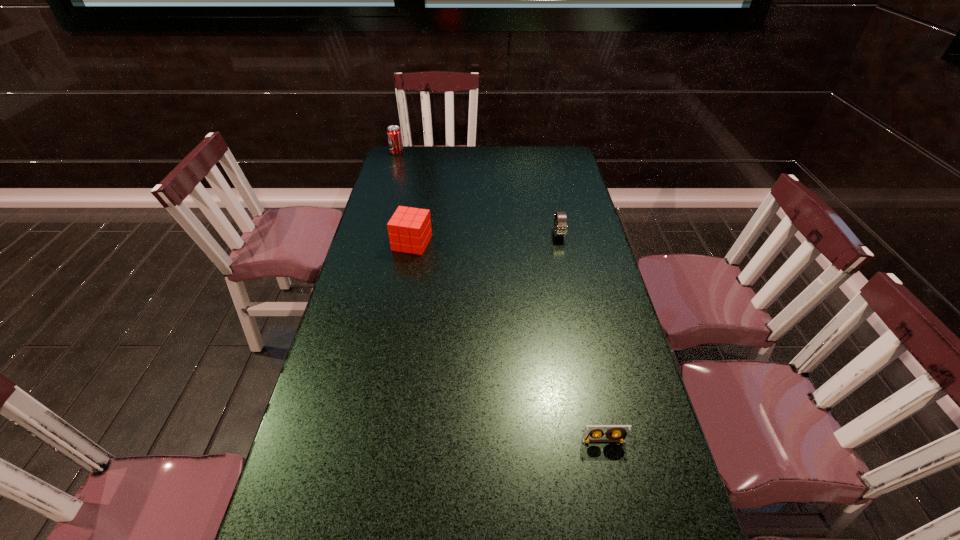
At what (x,y) coordinates should I click in order to perform the action: click on object at the far edge. Please return your answer as a coordinate pair (x, y). The width and height of the screenshot is (960, 540). Looking at the image, I should click on (394, 135).

The width and height of the screenshot is (960, 540). Find the location of `soda at the left edge`. soda at the left edge is located at coordinates (394, 135).

Locate an element on the screen. cube located at the left edge is located at coordinates (409, 229).

Where is `watch positioned at the right edge`? The image size is (960, 540). watch positioned at the right edge is located at coordinates (560, 229).

Find the location of `videotape that is at the right edge`. videotape that is at the right edge is located at coordinates (616, 433).

Locate an element on the screen. object present at the far left corner is located at coordinates (394, 135).

Locate an element on the screen. The image size is (960, 540). vacant space at the far edge is located at coordinates (438, 147).

You are a GUI agent. You are given a task and a screenshot of the screen. Output one action in this format:
    pyautogui.click(x=<x>, y=<y>)
    Task: Click on the free spot at the left edge of the desktop
    This screenshot has width=960, height=540.
    Given the screenshot: What is the action you would take?
    pyautogui.click(x=376, y=234)

You are a GUI agent. You are given a task and a screenshot of the screen. Output one action in this format:
    pyautogui.click(x=<x>, y=<y>)
    Task: Click on the free space at the right edge of the desktop
    
    Given the screenshot: What is the action you would take?
    pyautogui.click(x=554, y=193)

Image resolution: width=960 pixels, height=540 pixels. I want to click on vacant space at the far left corner, so click(399, 161).